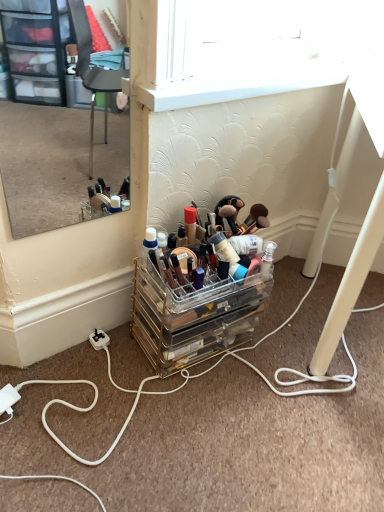
Locate an element on the screen. Image resolution: width=384 pixels, height=512 pixels. free location in front of clear acrylic makeup organizer at center is located at coordinates (192, 421).